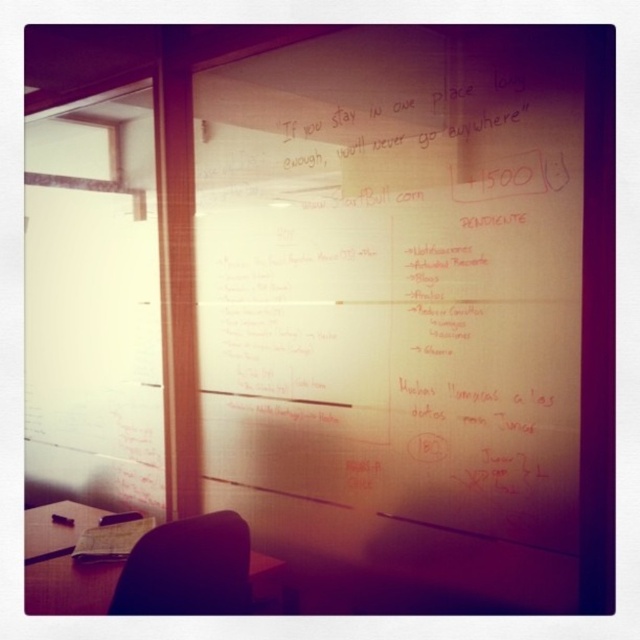
Question: Which point is closer to the camera?

Choices:
 (A) brown wooden table at lower left
 (B) wooden table at lower left

Answer: (A)

Question: Is brown wooden table at lower left closer to camera compared to wooden table at lower left?

Choices:
 (A) yes
 (B) no

Answer: (A)

Question: Considering the relative positions of brown wooden table at lower left and wooden table at lower left in the image provided, where is brown wooden table at lower left located with respect to wooden table at lower left?

Choices:
 (A) left
 (B) right

Answer: (B)

Question: Which point is closer to the camera?

Choices:
 (A) brown wooden table at lower left
 (B) wooden table at lower left

Answer: (A)

Question: Which point is farther to the camera?

Choices:
 (A) (253, 584)
 (B) (42, 516)

Answer: (B)

Question: Can you confirm if brown wooden table at lower left is bigger than wooden table at lower left?

Choices:
 (A) no
 (B) yes

Answer: (B)